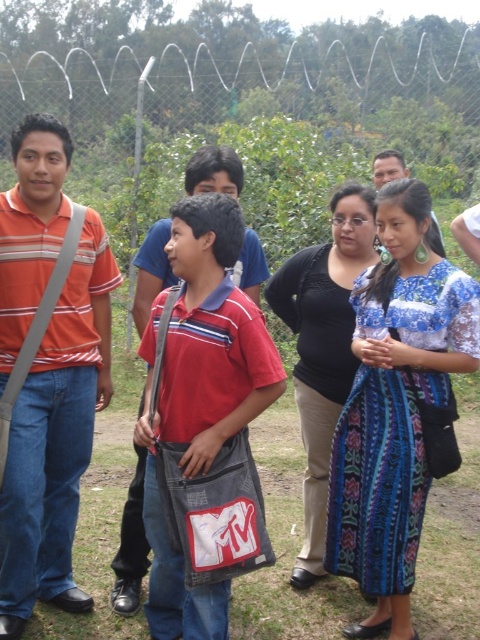
Question: Which point is farther to the camera?

Choices:
 (A) (396, 156)
 (B) (291, 285)
 (C) (439, 360)
 (D) (132, 518)

Answer: (A)

Question: Among these points, which one is farthest from the camera?

Choices:
 (A) (142, 284)
 (B) (29, 556)
 (C) (386, 166)

Answer: (C)

Question: Which point appears closest to the camera in this image?

Choices:
 (A) tap(319, 442)
 (B) tap(367, 321)
 (C) tap(404, 166)
 (D) tap(43, 401)

Answer: (D)

Question: Does matte striped shirt at left appear under blue woven skirt at center?

Choices:
 (A) yes
 (B) no

Answer: (B)

Question: Is blue woven skirt at center behind matte black shirt at center?

Choices:
 (A) no
 (B) yes

Answer: (A)

Question: Can you confirm if denim jeans at center is positioned below matte black shirt at center?

Choices:
 (A) no
 (B) yes

Answer: (B)